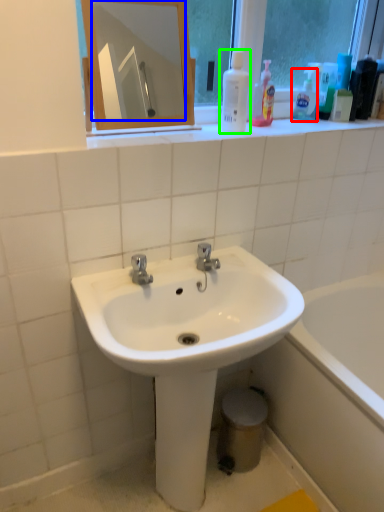
Question: Estimate the real-world distances between objects in this image. Which object is farther from cleaning product (highlighted by a red box), mirror (highlighted by a blue box) or cleaning product (highlighted by a green box)?

Choices:
 (A) mirror
 (B) cleaning product

Answer: (A)